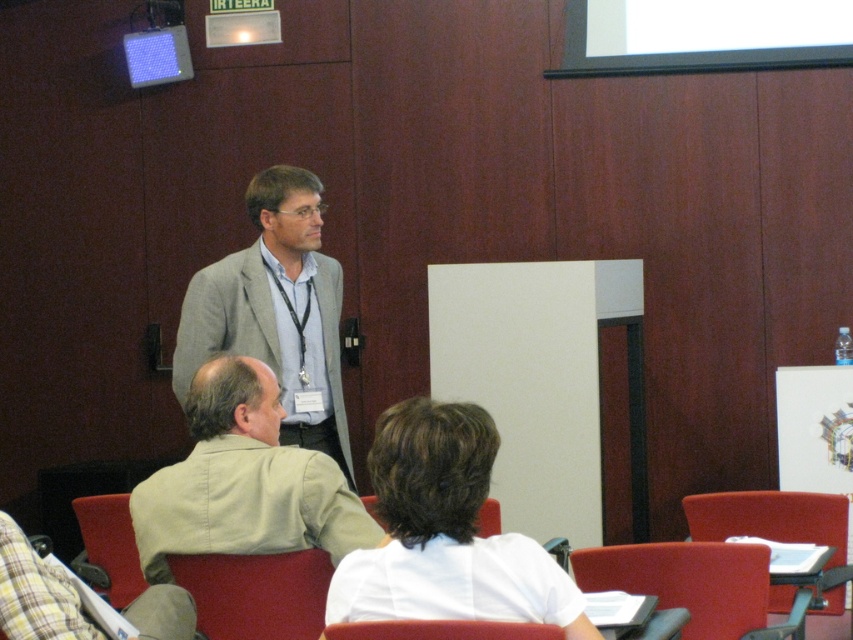
You are an event organizer who needs to ensure that all attendees can see the speaker clearly. Given the light beige shirt at lower left and the red fabric chair at lower center, which object is bigger and might block the view if placed in front?

The light beige shirt at lower left is larger than the red fabric chair at lower center, so it might block the view if placed in front.